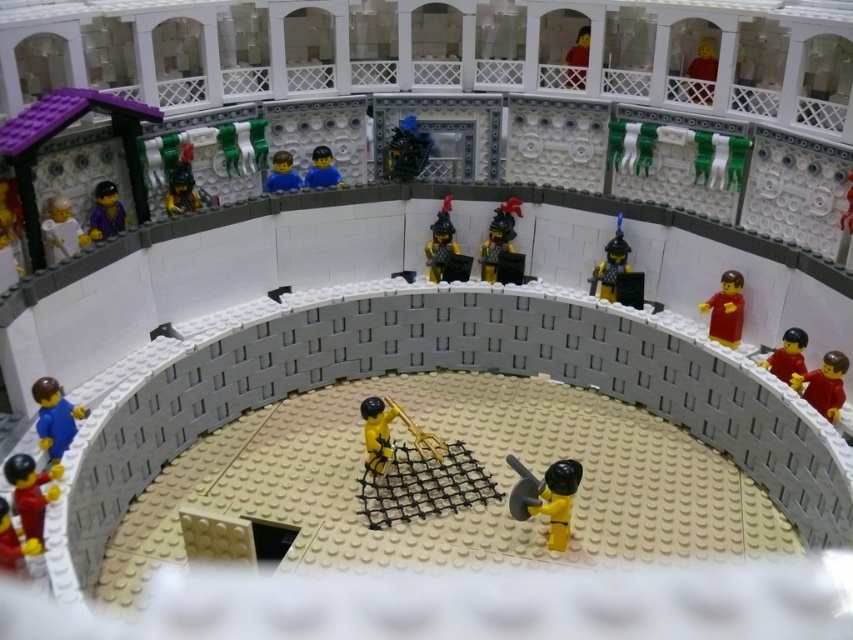
Does point (180, 186) come behind point (582, 52)?

No, (180, 186) is closer to viewer.

Where is `matte black helmet at upper left`? This screenshot has height=640, width=853. matte black helmet at upper left is located at coordinates (181, 189).

Does red plastic figure at right appear on the right side of shiny blue armor at center?

Correct, you'll find red plastic figure at right to the right of shiny blue armor at center.

Between red plastic figure at right and shiny blue armor at center, which one is positioned higher?

shiny blue armor at center is higher up.

Does point (820, 374) come closer to viewer compared to point (407, 120)?

Yes, point (820, 374) is in front of point (407, 120).

Identify the location of red plastic figure at right. [822, 385].

Which of these two, shiny red figure at lower left or purple matte minifigure at upper left, stands shorter?

shiny red figure at lower left

Is point (10, 470) in front of point (86, 230)?

Yes.

This screenshot has height=640, width=853. In order to click on shiny red figure at lower left in this screenshot , I will do `click(30, 492)`.

Image resolution: width=853 pixels, height=640 pixels. I want to click on shiny red figure at lower left, so click(30, 492).